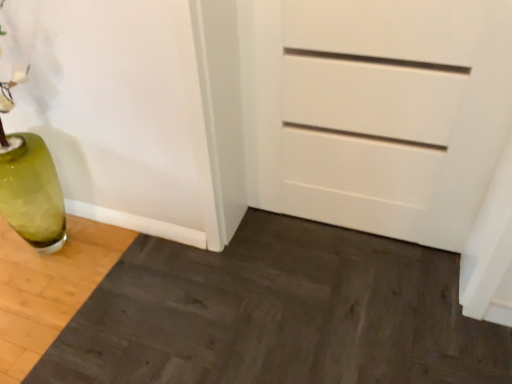
Question: Based on their sizes in the image, would you say white matte chest of drawers at center is bigger or smaller than dark wood doormat at lower left?

Choices:
 (A) small
 (B) big

Answer: (A)

Question: Considering the positions of point (301, 39) and point (477, 339), is point (301, 39) closer or farther from the camera than point (477, 339)?

Choices:
 (A) closer
 (B) farther

Answer: (A)

Question: Considering the relative positions of white matte chest of drawers at center and dark wood doormat at lower left in the image provided, is white matte chest of drawers at center to the left or to the right of dark wood doormat at lower left?

Choices:
 (A) right
 (B) left

Answer: (A)

Question: Is dark wood doormat at lower left in front of or behind white matte chest of drawers at center in the image?

Choices:
 (A) behind
 (B) front

Answer: (B)

Question: Would you say dark wood doormat at lower left is to the left or to the right of white matte chest of drawers at center in the picture?

Choices:
 (A) left
 (B) right

Answer: (A)

Question: From the image's perspective, is dark wood doormat at lower left above or below white matte chest of drawers at center?

Choices:
 (A) above
 (B) below

Answer: (B)

Question: Considering the positions of dark wood doormat at lower left and white matte chest of drawers at center in the image, is dark wood doormat at lower left taller or shorter than white matte chest of drawers at center?

Choices:
 (A) short
 (B) tall

Answer: (A)